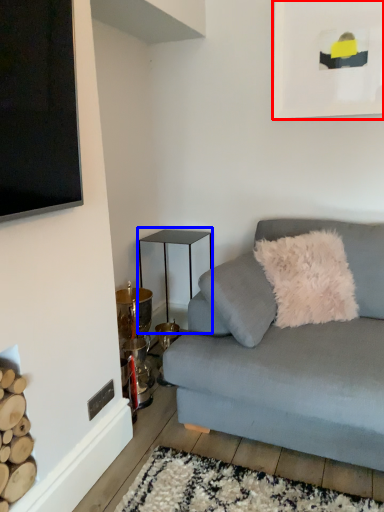
Question: Which point is closer to the camera, picture frame (highlighted by a red box) or table (highlighted by a blue box)?

Choices:
 (A) picture frame
 (B) table

Answer: (A)